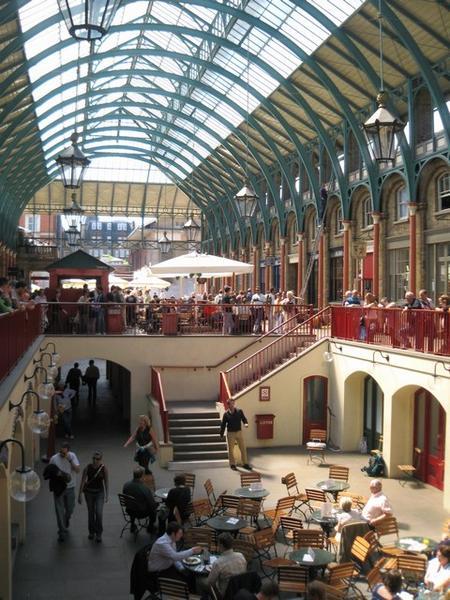
Locate an element on the screen. The image size is (450, 600). plates is located at coordinates (192, 562), (210, 568).